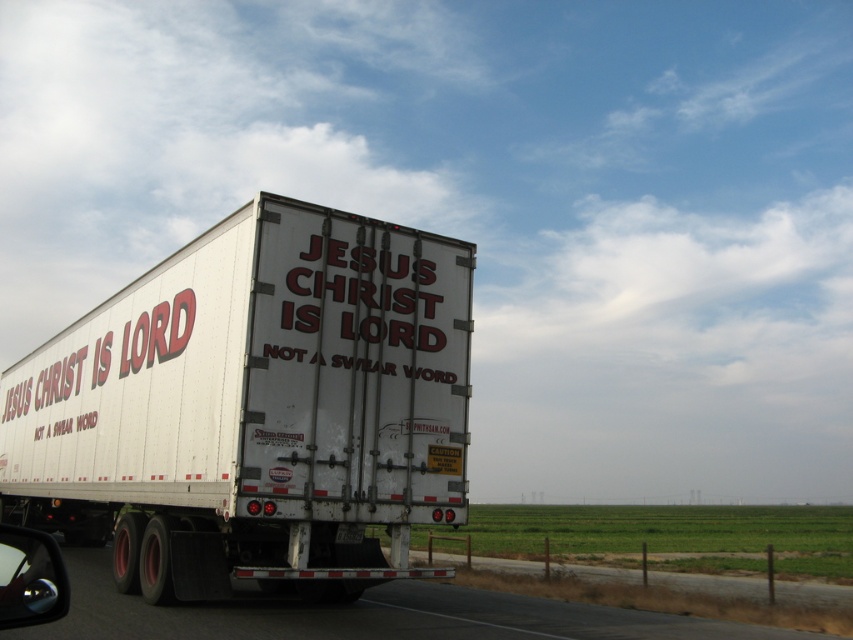
Question: In this image, where is white matte trailer truck at center located relative to shiny chrome side mirror at lower left?

Choices:
 (A) left
 (B) right

Answer: (B)

Question: Can you confirm if metallic gray highway at lower center is positioned to the left of shiny chrome side mirror at lower left?

Choices:
 (A) no
 (B) yes

Answer: (A)

Question: Which object is positioned closest to the shiny chrome side mirror at lower left?

Choices:
 (A) white matte trailer truck at center
 (B) metallic gray highway at lower center

Answer: (A)

Question: Which point is closer to the camera taking this photo?

Choices:
 (A) (10, 544)
 (B) (235, 612)

Answer: (A)

Question: Is white matte trailer truck at center positioned at the back of shiny chrome side mirror at lower left?

Choices:
 (A) no
 (B) yes

Answer: (B)

Question: Among these objects, which one is farthest from the camera?

Choices:
 (A) white matte trailer truck at center
 (B) shiny chrome side mirror at lower left
 (C) metallic gray highway at lower center

Answer: (A)